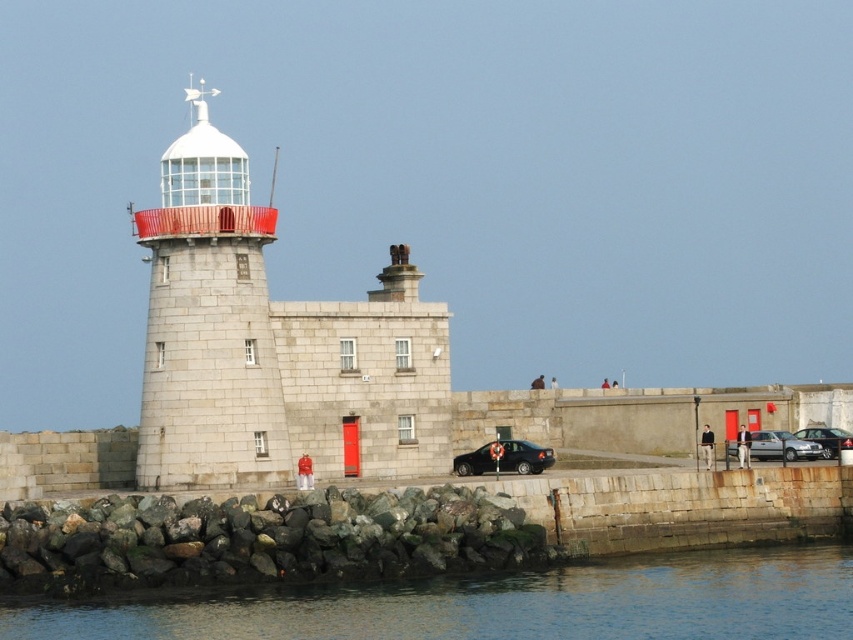
Question: Among these objects, which one is nearest to the camera?

Choices:
 (A) white glass lighthouse at center
 (B) black matte sedan at center
 (C) shiny silver car at center
 (D) transparent water at lower center

Answer: (D)

Question: Among these objects, which one is farthest from the camera?

Choices:
 (A) shiny silver car at center
 (B) white glass lighthouse at center

Answer: (A)

Question: Does green mossy rock at lower center have a larger size compared to shiny silver car at center?

Choices:
 (A) yes
 (B) no

Answer: (A)

Question: Does white glass lighthouse at center have a greater width compared to black matte sedan at center?

Choices:
 (A) no
 (B) yes

Answer: (B)

Question: Does green mossy rock at lower center appear over silver metallic sedan at right?

Choices:
 (A) yes
 (B) no

Answer: (B)

Question: Among these points, which one is nearest to the camera?

Choices:
 (A) (242, 282)
 (B) (285, 612)
 (C) (837, 449)
 (D) (807, 442)

Answer: (B)